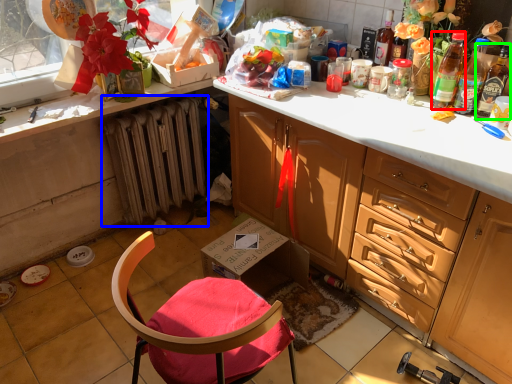
Question: Based on their relative distances, which object is nearer to bottle (highlighted by a red box)? Choose from radiator (highlighted by a blue box) and bottle (highlighted by a green box).

Choices:
 (A) radiator
 (B) bottle

Answer: (B)